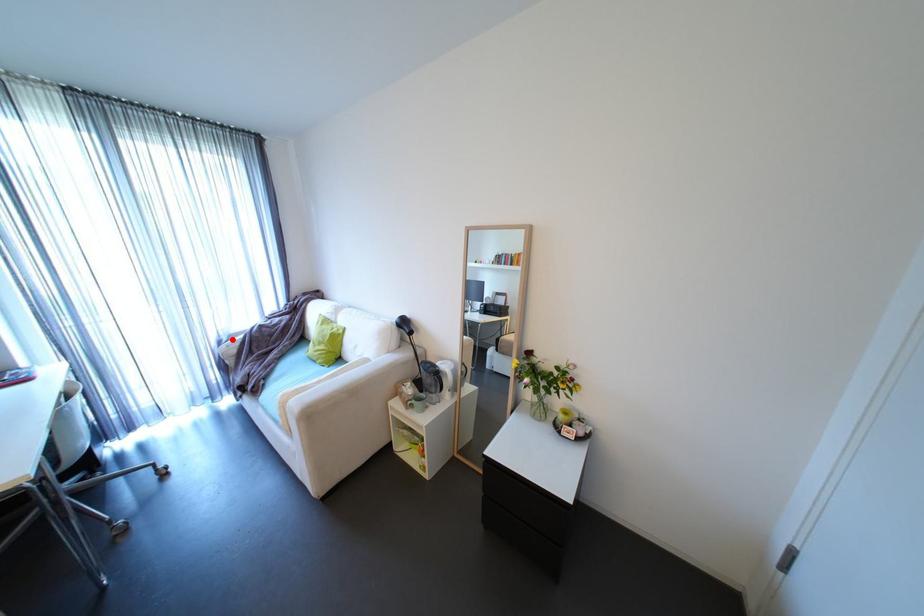
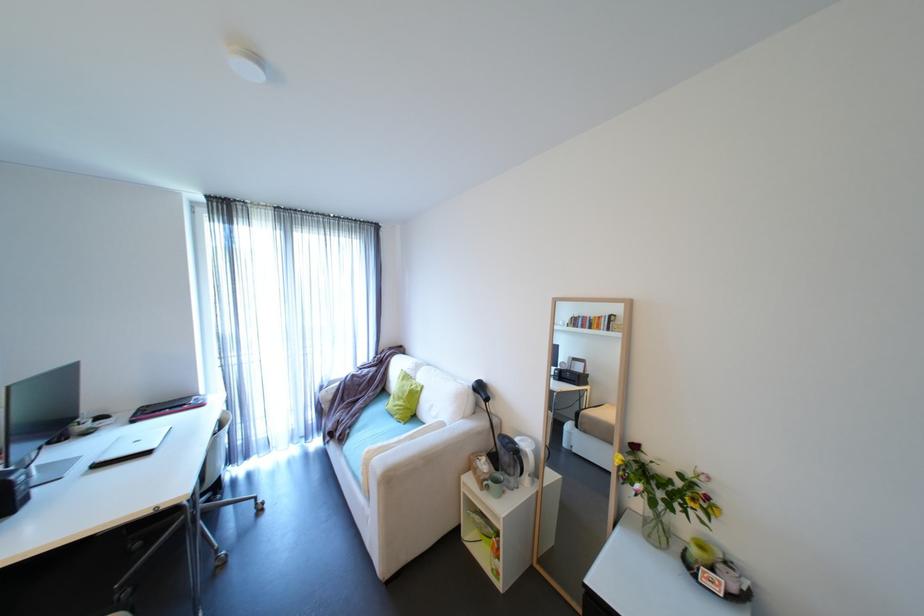
Locate, in the second image, the point that corresponds to the highlighted location in the first image.

(333, 386)